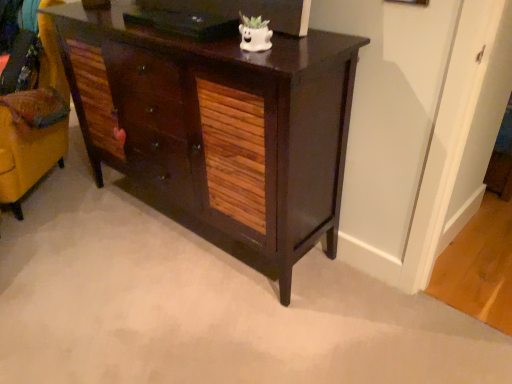
Question: From a real-world perspective, is dark wood cabinet at center physically located above or below velvet yellow swivel chair at left?

Choices:
 (A) below
 (B) above

Answer: (B)

Question: Considering their positions, is dark wood cabinet at center located in front of or behind velvet yellow swivel chair at left?

Choices:
 (A) front
 (B) behind

Answer: (A)

Question: Is dark wood cabinet at center taller or shorter than velvet yellow swivel chair at left?

Choices:
 (A) short
 (B) tall

Answer: (A)

Question: Is velvet yellow swivel chair at left situated inside dark wood cabinet at center or outside?

Choices:
 (A) inside
 (B) outside

Answer: (B)

Question: Looking at their shapes, would you say velvet yellow swivel chair at left is wider or thinner than dark wood cabinet at center?

Choices:
 (A) wide
 (B) thin

Answer: (A)

Question: Is velvet yellow swivel chair at left in front of or behind dark wood cabinet at center in the image?

Choices:
 (A) front
 (B) behind

Answer: (B)

Question: Is velvet yellow swivel chair at left taller or shorter than dark wood cabinet at center?

Choices:
 (A) short
 (B) tall

Answer: (B)